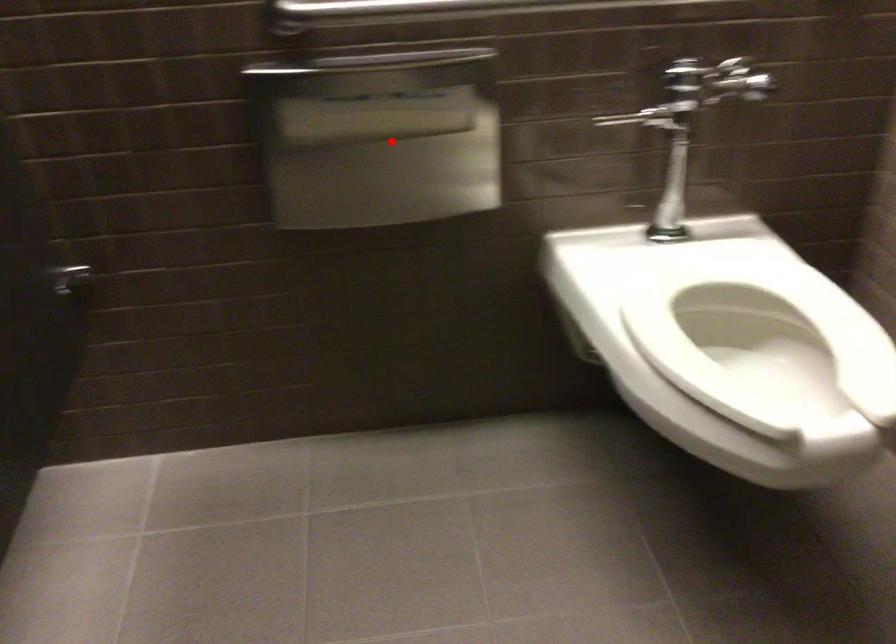
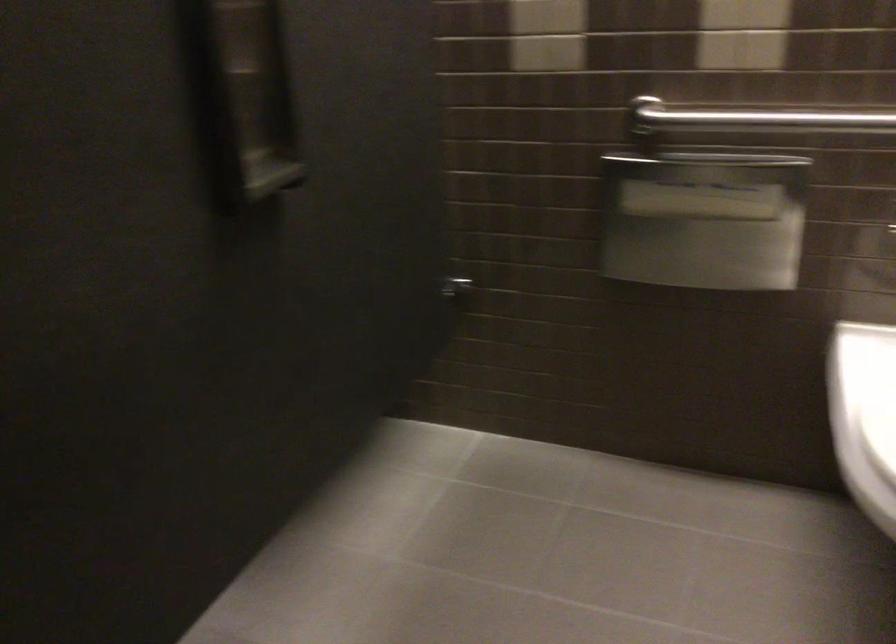
Find the pixel in the second image that matches the highlighted location in the first image.

(703, 220)